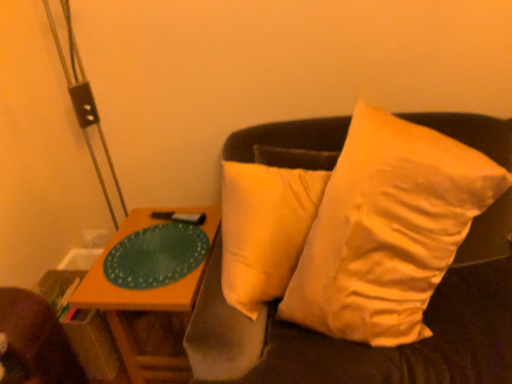
Question: Can you confirm if green matte glass plate at left is smaller than wooden table at left?

Choices:
 (A) yes
 (B) no

Answer: (A)

Question: From a real-world perspective, is green matte glass plate at left physically below wooden table at left?

Choices:
 (A) no
 (B) yes

Answer: (A)

Question: Considering the relative positions of green matte glass plate at left and wooden table at left in the image provided, is green matte glass plate at left to the left of wooden table at left from the viewer's perspective?

Choices:
 (A) yes
 (B) no

Answer: (A)

Question: From the image's perspective, would you say green matte glass plate at left is shown under wooden table at left?

Choices:
 (A) no
 (B) yes

Answer: (A)

Question: Is green matte glass plate at left thinner than wooden table at left?

Choices:
 (A) yes
 (B) no

Answer: (A)

Question: Can you confirm if green matte glass plate at left is positioned to the right of wooden table at left?

Choices:
 (A) yes
 (B) no

Answer: (B)

Question: From a real-world perspective, is white soft pillow at upper right located beneath green matte glass plate at left?

Choices:
 (A) yes
 (B) no

Answer: (B)

Question: From the image's perspective, is white soft pillow at upper right on green matte glass plate at left?

Choices:
 (A) no
 (B) yes

Answer: (B)

Question: Does white soft pillow at upper right appear on the right side of green matte glass plate at left?

Choices:
 (A) no
 (B) yes

Answer: (B)

Question: Considering the relative sizes of white soft pillow at upper right and green matte glass plate at left in the image provided, is white soft pillow at upper right smaller than green matte glass plate at left?

Choices:
 (A) yes
 (B) no

Answer: (B)

Question: Is white soft pillow at upper right shorter than green matte glass plate at left?

Choices:
 (A) no
 (B) yes

Answer: (A)

Question: Is white soft pillow at upper right bigger than green matte glass plate at left?

Choices:
 (A) no
 (B) yes

Answer: (B)

Question: Can white soft pillow at upper right be found inside wooden table at left?

Choices:
 (A) no
 (B) yes

Answer: (A)